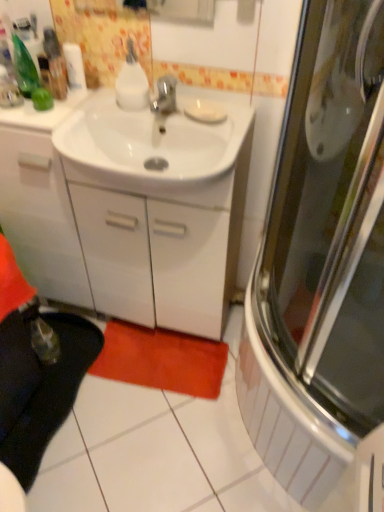
In order to click on vacant space positioned to the left of white matte soap at center in this screenshot , I will do `click(163, 112)`.